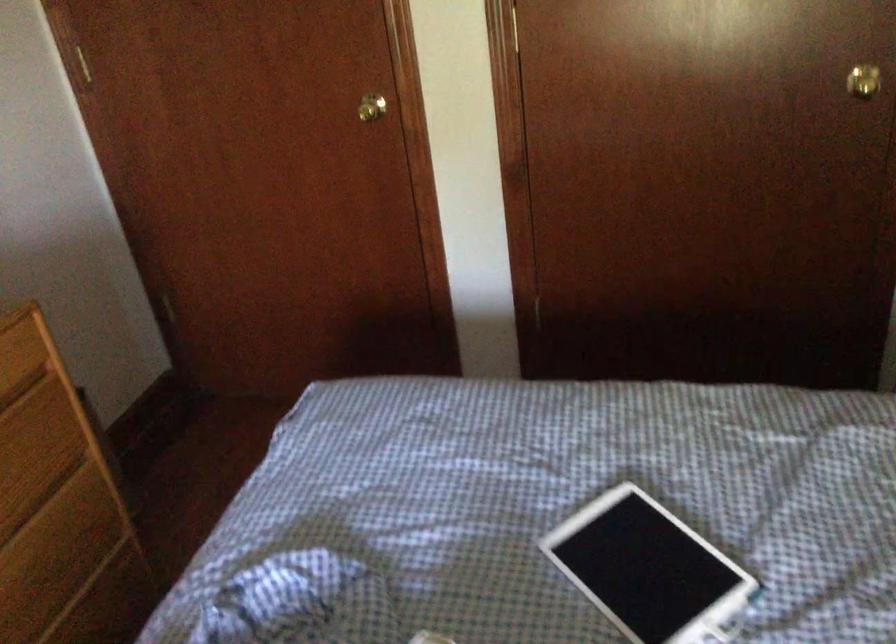
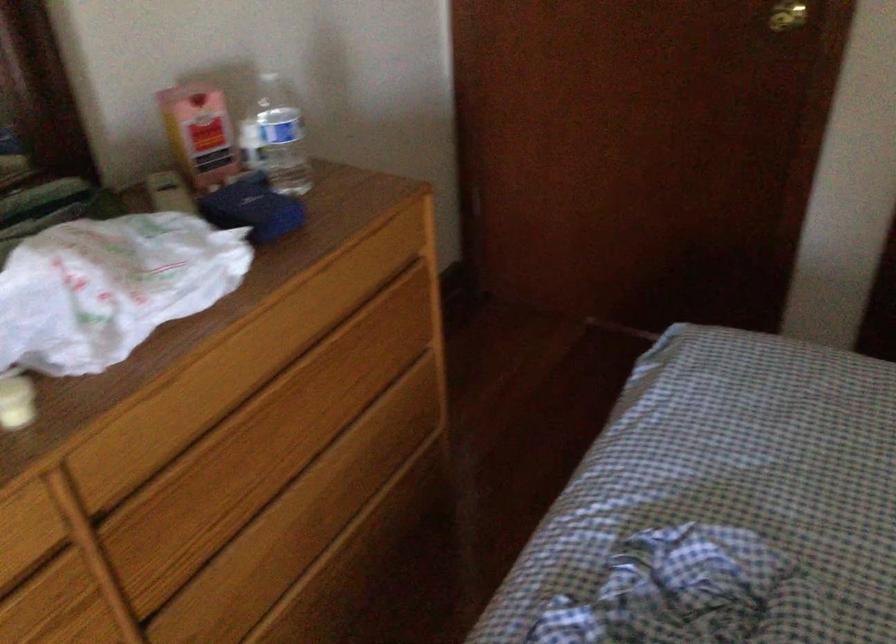
Where in the second image is the point corresponding to [380,108] from the first image?

(787, 15)